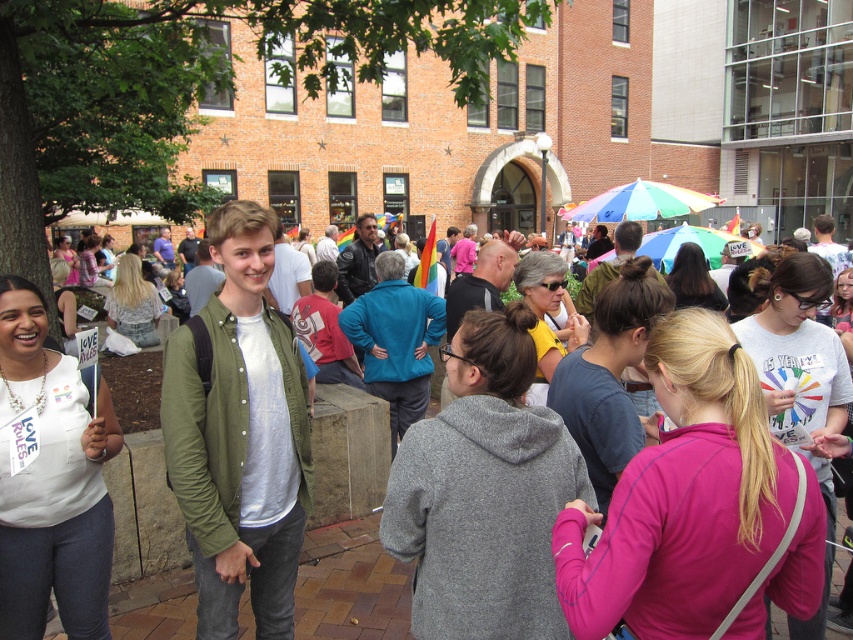
Question: Which of the following is the closest to the observer?

Choices:
 (A) (677, 294)
 (B) (544, 300)
 (C) (781, 260)
 (D) (149, 296)

Answer: (C)

Question: Does white printed t-shirt at center have a smaller size compared to matte pink dress at center?

Choices:
 (A) yes
 (B) no

Answer: (A)

Question: Which of the following is the farthest from the observer?

Choices:
 (A) yellow matte shirt at center
 (B) pink fleece jacket at center
 (C) gray fleece jacket at center
 (D) blonde hair at center

Answer: (D)

Question: Which is farther from the matte green jacket at center?

Choices:
 (A) dark brown hair at center
 (B) yellow matte shirt at center
 (C) white printed t-shirt at center

Answer: (A)

Question: Can you confirm if blonde hair at center is positioned below dark brown hair at center?

Choices:
 (A) no
 (B) yes

Answer: (B)

Question: Does pink fleece jacket at center have a lesser width compared to gray fleece jacket at center?

Choices:
 (A) no
 (B) yes

Answer: (A)